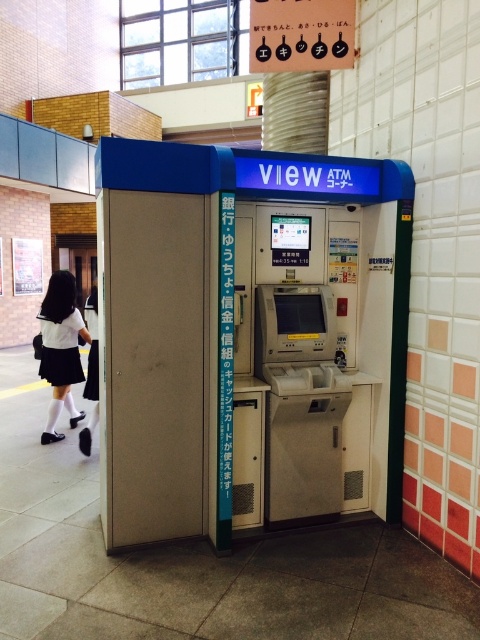
You are standing in front of the ATM and need to place a small box on the floor next to it. Which object, the matte plastic atm at center or the white matte skirt at lower left, would you choose to place the box near to ensure it fits without overlapping?

The matte plastic atm at center is bigger than the white matte skirt at lower left, so placing the box near the white matte skirt at lower left would leave more space and prevent overlapping.

You are standing in front of the ATM machine at the center of the image. The screen is located at point (245, 336). Where exactly is the screen located on the ATM machine?

The screen is located at the center of the ATM machine as indicated by point (245, 336).

You are standing in front of the ATM machine and need to access both the matte plastic atm at center and the white matte skirt at lower left. Which object will you interact with first based on their positions?

The matte plastic atm at center is closer to the viewer than the white matte skirt at lower left, so you will interact with the matte plastic atm at center first.